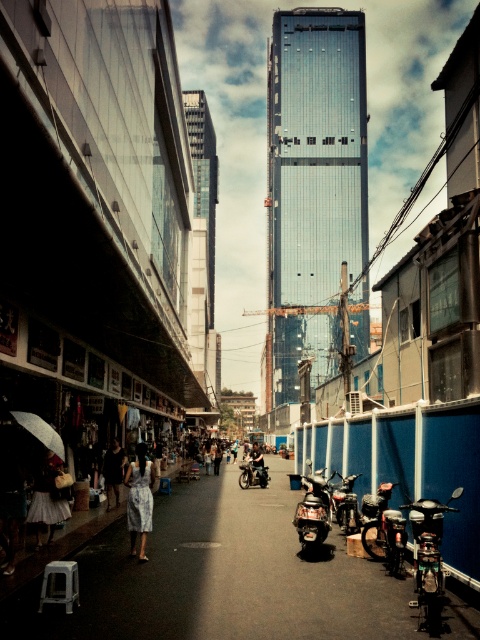
You are a delivery rider who needs to quickly access your dark blue leather jacket at center to protect yourself from the rain. However, your shiny black motorcycle at center is blocking it. Can you reach your jacket without moving the motorcycle?

The shiny black motorcycle at center is in front of the dark blue leather jacket at center, so you cannot reach the dark blue leather jacket at center without moving the motorcycle.

You are a pedestrian walking along the street and see the matte white umbrella at lower left and the light blue dress at center. Which object is positioned more to the left side of the street?

The matte white umbrella at lower left is positioned more to the left side of the street than the light blue dress at center.

You are a pedestrian walking down the street and see the matte white umbrella at lower left and the printed fabric dress at center. Which object is wider?

The matte white umbrella at lower left might be wider than printed fabric dress at center.